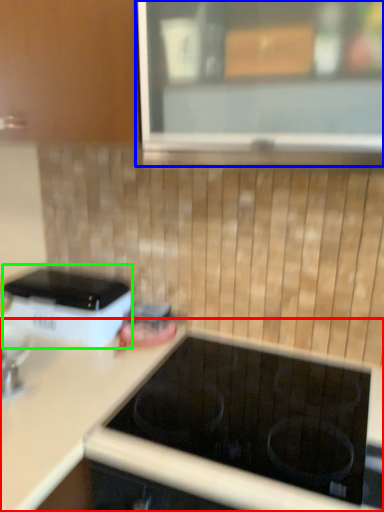
Question: Estimate the real-world distances between objects in this image. Which object is closer to countertop (highlighted by a red box), window (highlighted by a blue box) or home appliance (highlighted by a green box)?

Choices:
 (A) window
 (B) home appliance

Answer: (B)